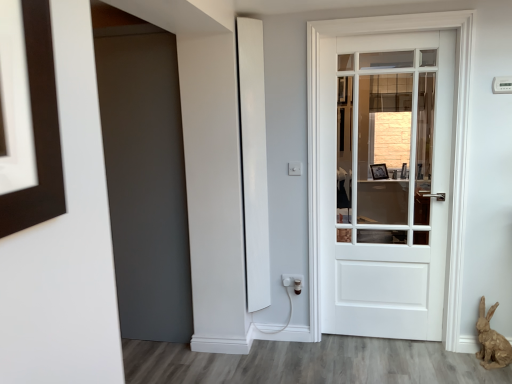
Question: Does white plastic electric outlet at lower center lie behind white matte door at center?

Choices:
 (A) no
 (B) yes

Answer: (B)

Question: From the image's perspective, is white plastic electric outlet at lower center located above white matte door at center?

Choices:
 (A) no
 (B) yes

Answer: (A)

Question: Can you confirm if white plastic electric outlet at lower center is positioned to the left of white matte door at center?

Choices:
 (A) no
 (B) yes

Answer: (B)

Question: Considering the relative positions of white plastic electric outlet at lower center and white matte door at center in the image provided, is white plastic electric outlet at lower center to the right of white matte door at center from the viewer's perspective?

Choices:
 (A) no
 (B) yes

Answer: (A)

Question: Can you confirm if white plastic electric outlet at lower center is wider than white matte door at center?

Choices:
 (A) no
 (B) yes

Answer: (A)

Question: Is white matte door at center surrounded by white plastic electric outlet at lower center?

Choices:
 (A) no
 (B) yes

Answer: (A)

Question: Considering the relative positions of white matte door at center and brown papier-mâché rabbit at lower right in the image provided, is white matte door at center behind brown papier-mâché rabbit at lower right?

Choices:
 (A) yes
 (B) no

Answer: (A)

Question: From the image's perspective, is white matte door at center over brown papier-mâché rabbit at lower right?

Choices:
 (A) yes
 (B) no

Answer: (A)

Question: Is white matte door at center thinner than brown papier-mâché rabbit at lower right?

Choices:
 (A) no
 (B) yes

Answer: (B)

Question: Is white matte door at center at the right side of brown papier-mâché rabbit at lower right?

Choices:
 (A) no
 (B) yes

Answer: (A)

Question: Is brown papier-mâché rabbit at lower right at the back of white matte door at center?

Choices:
 (A) no
 (B) yes

Answer: (A)

Question: Are white matte door at center and brown papier-mâché rabbit at lower right located far from each other?

Choices:
 (A) no
 (B) yes

Answer: (B)

Question: From a real-world perspective, does brown papier-mâché rabbit at lower right stand above white plastic electric outlet at lower center?

Choices:
 (A) no
 (B) yes

Answer: (A)